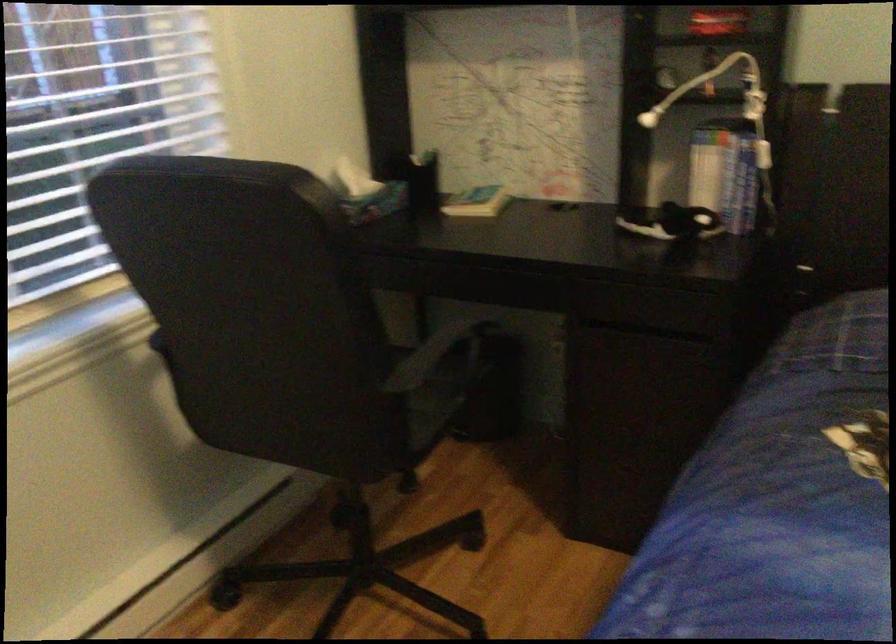
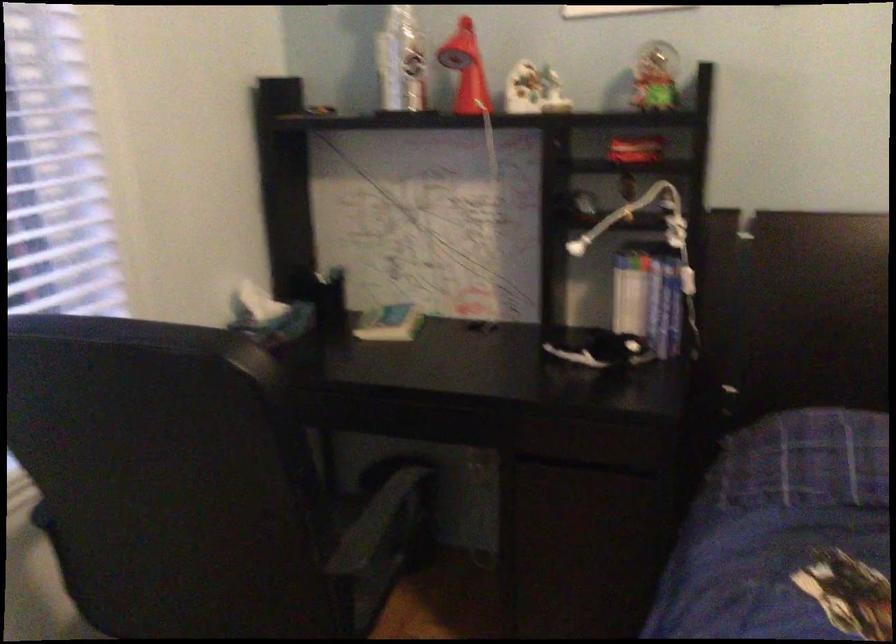
Locate, in the second image, the point that corresponds to (x=647, y=118) in the first image.

(576, 247)